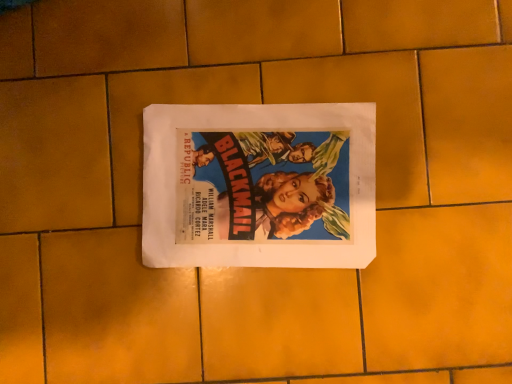
The image size is (512, 384). Describe the element at coordinates (259, 185) in the screenshot. I see `matte paper poster at center` at that location.

You are a GUI agent. You are given a task and a screenshot of the screen. Output one action in this format:
    pyautogui.click(x=<x>, y=<y>)
    Task: Click on the matte paper poster at center
    
    Given the screenshot: What is the action you would take?
    tap(259, 185)

Locate an element on the screen. matte paper poster at center is located at coordinates (259, 185).